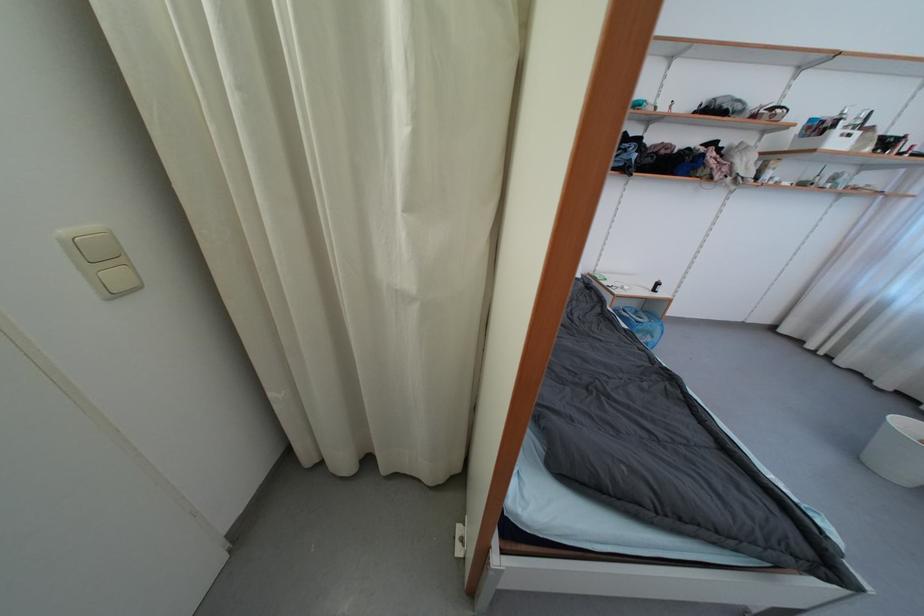
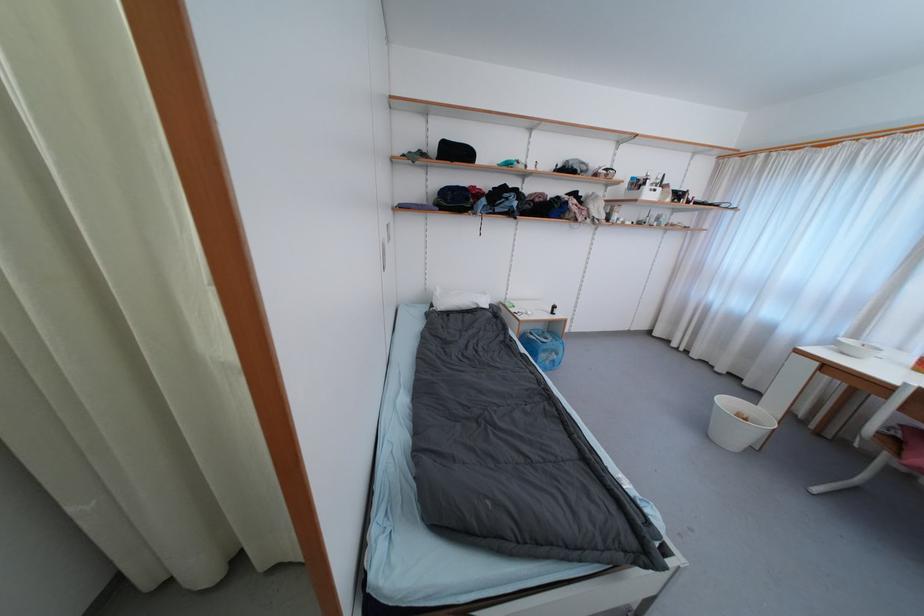
Question: The camera is either moving clockwise (left) or counter-clockwise (right) around the object. The first image is from the beginning of the video and the second image is from the end. Is the camera moving left or right when shooting the video?

Choices:
 (A) Left
 (B) Right

Answer: (A)